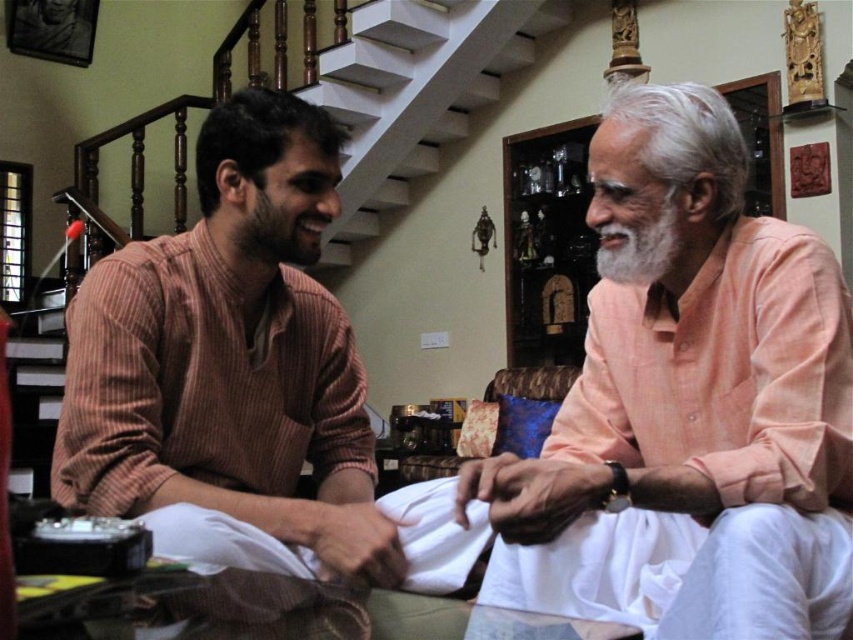
Between brown striped shirt at left and white wooden stairs at upper center, which one is positioned lower?

brown striped shirt at left

Is brown striped shirt at left to the left of white wooden stairs at upper center from the viewer's perspective?

Correct, you'll find brown striped shirt at left to the left of white wooden stairs at upper center.

Does point (338, 532) come farther from viewer compared to point (440, 132)?

That is False.

Where is `brown striped shirt at left`? brown striped shirt at left is located at coordinates (225, 364).

Who is shorter, brown striped shirt at left or white soft beard at center?

Standing shorter between the two is white soft beard at center.

Can you confirm if brown striped shirt at left is positioned below white soft beard at center?

Correct, brown striped shirt at left is located below white soft beard at center.

Looking at this image, who is more distant from viewer, (74, 324) or (659, 209)?

The point (74, 324) is more distant.

Where is `brown striped shirt at left`? brown striped shirt at left is located at coordinates pyautogui.click(x=225, y=364).

Can you confirm if brown matte beard at upper left is bigger than white soft beard at center?

Correct, brown matte beard at upper left is larger in size than white soft beard at center.

Does brown matte beard at upper left lie behind white soft beard at center?

Yes, it is.

Measure the distance between brown matte beard at upper left and camera.

brown matte beard at upper left and camera are 1.29 meters apart from each other.

This screenshot has width=853, height=640. Identify the location of brown matte beard at upper left. (281, 224).